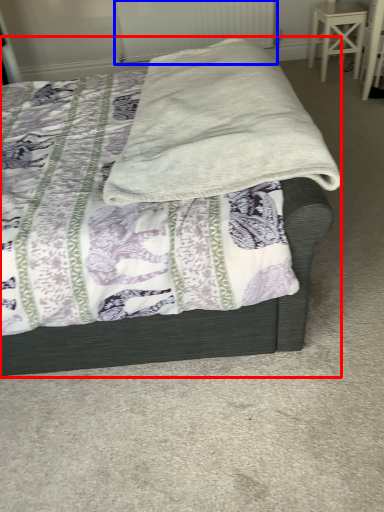
Question: Which object appears farthest to the camera in this image, bed (highlighted by a red box) or radiator (highlighted by a blue box)?

Choices:
 (A) bed
 (B) radiator

Answer: (B)